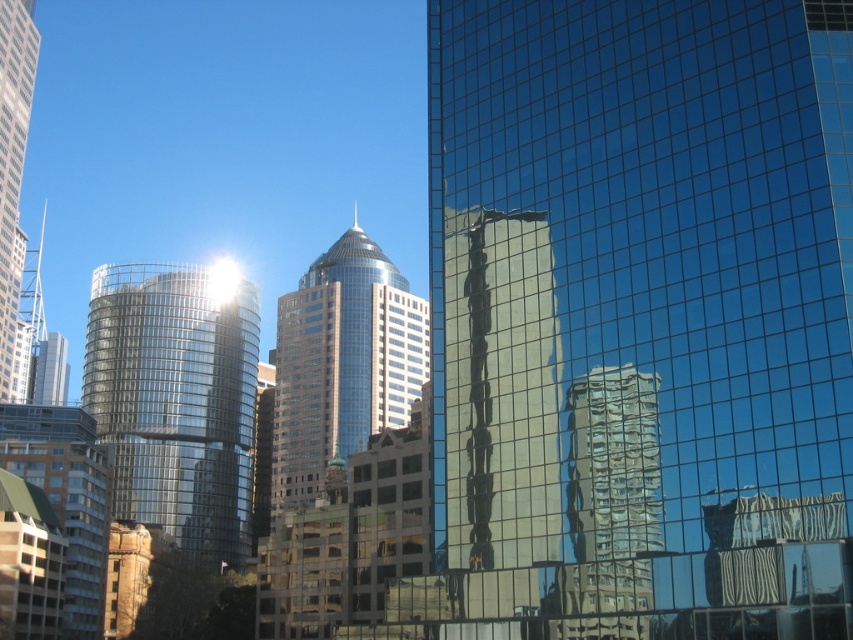
Is transparent glass skyscraper at center positioned behind shiny glass tower at center?

No, it is in front of shiny glass tower at center.

Based on the photo, who is more distant from viewer, (827,524) or (236,474)?

The point (236,474) is more distant.

Does point (488, 536) come behind point (137, 428)?

No, it is not.

At what (x,y) coordinates should I click in order to perform the action: click on transparent glass skyscraper at center. Please return your answer as a coordinate pair (x, y). Looking at the image, I should click on (648, 298).

Does shiny glass tower at center have a smaller size compared to reflective glass building at center?

No, shiny glass tower at center is not smaller than reflective glass building at center.

What are the coordinates of `shiny glass tower at center` in the screenshot? It's located at (177, 403).

Is point (541, 257) farther from camera compared to point (6, 58)?

No, (541, 257) is closer to viewer.

Locate an element on the screen. The height and width of the screenshot is (640, 853). reflective glass skyscraper at center is located at coordinates (500, 410).